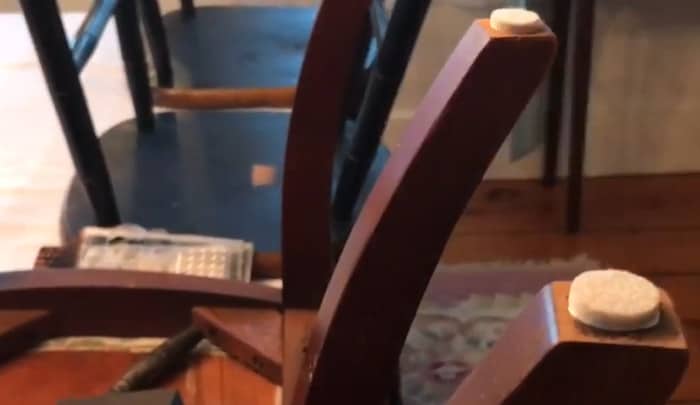
What are the coordinates of `rug fringe` in the screenshot? It's located at [507, 262].